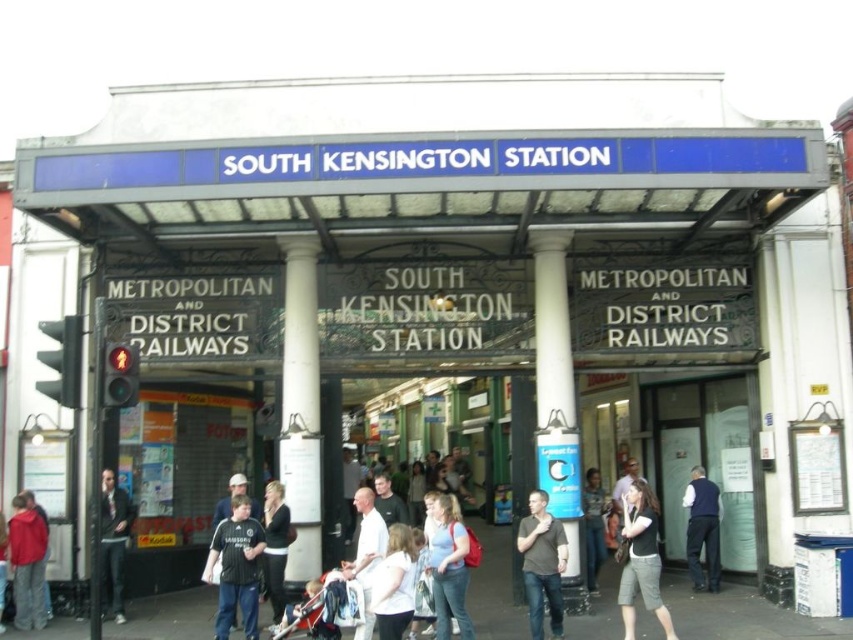
Question: Which is nearer to the light brown leather jacket at center?

Choices:
 (A) transparent glass door at center
 (B) dark blue jersey at lower left
 (C) matte red jacket at lower left
 (D) black fabric jacket at center

Answer: (A)

Question: Among these points, which one is farthest from the camera?

Choices:
 (A) (659, 611)
 (B) (691, 577)
 (C) (369, 579)

Answer: (B)

Question: Where is black fabric shirt at center located in relation to black fabric jacket at center in the image?

Choices:
 (A) above
 (B) below

Answer: (A)

Question: Which point is farther from the camera taking this photo?

Choices:
 (A) (10, 538)
 (B) (271, 602)
 (C) (373, 547)
 (D) (285, 248)

Answer: (D)

Question: In this image, where is black fabric shirt at center located relative to white fabric shirt at center?

Choices:
 (A) left
 (B) right

Answer: (B)

Question: Can you confirm if dark blue vest at lower right is positioned to the right of light brown leather jacket at center?

Choices:
 (A) yes
 (B) no

Answer: (A)